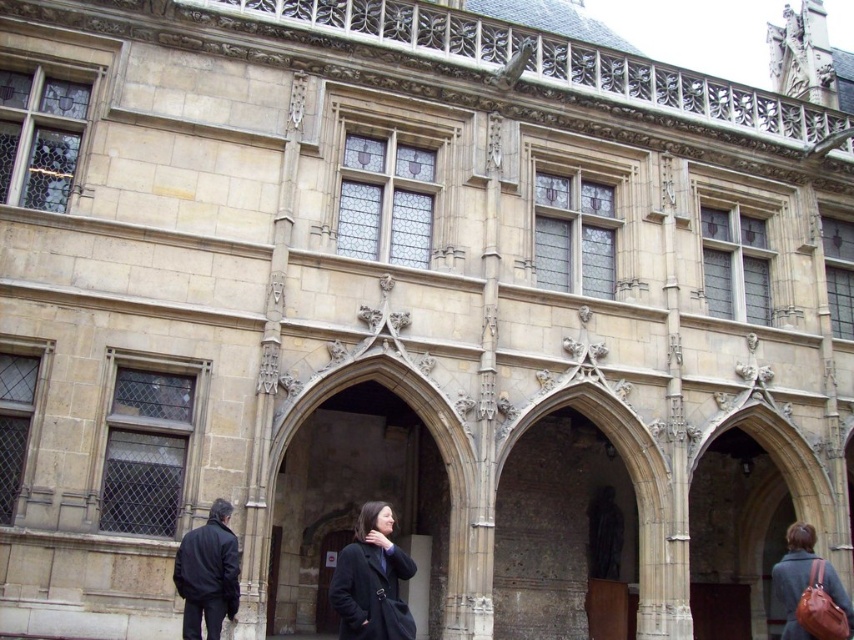
Question: Estimate the real-world distances between objects in this image. Which object is closer to the matte black coat at center?

Choices:
 (A) brown leather bag at lower right
 (B) black matte jacket at lower left

Answer: (B)

Question: Which point appears farthest from the camera in this image?

Choices:
 (A) (569, 522)
 (B) (272, 625)
 (C) (768, 515)
 (D) (340, 584)

Answer: (C)

Question: Observing the image, what is the correct spatial positioning of stone archway at center in reference to brown leather bag at lower right?

Choices:
 (A) left
 (B) right

Answer: (A)

Question: Is smooth stone archway at center wider than matte black coat at center?

Choices:
 (A) no
 (B) yes

Answer: (B)

Question: Does stone archway at center appear over black matte jacket at lower left?

Choices:
 (A) no
 (B) yes

Answer: (A)

Question: Based on their relative distances, which object is farther from the matte black coat at center?

Choices:
 (A) stone textured archway at center
 (B) stone archway at center
 (C) brown leather bag at lower right

Answer: (C)